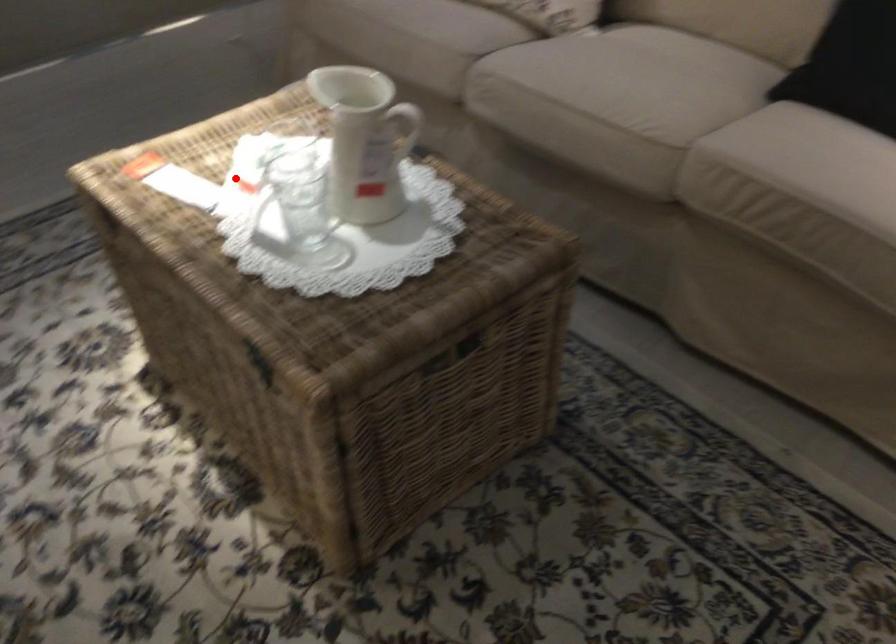
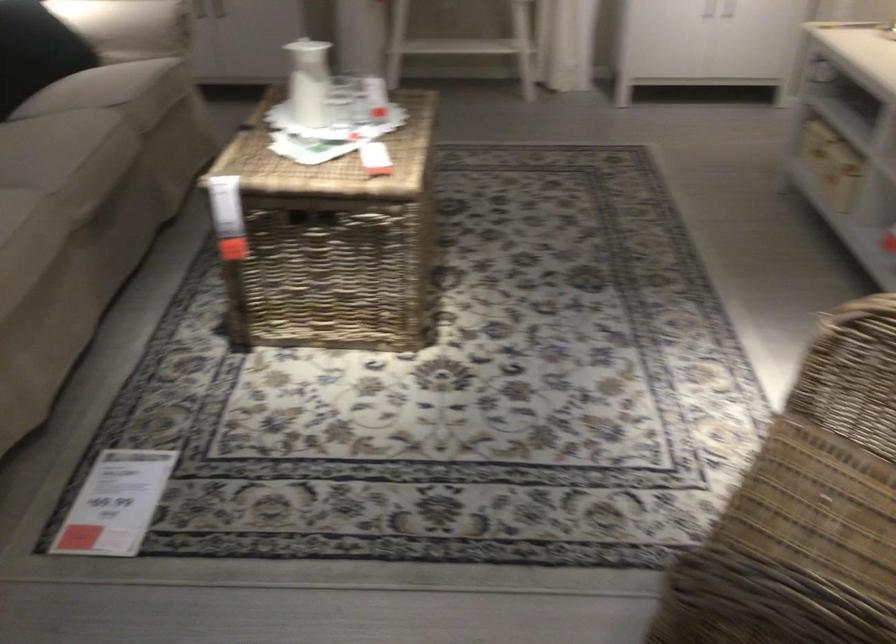
In the second image, find the point that corresponds to the highlighted location in the first image.

(314, 216)